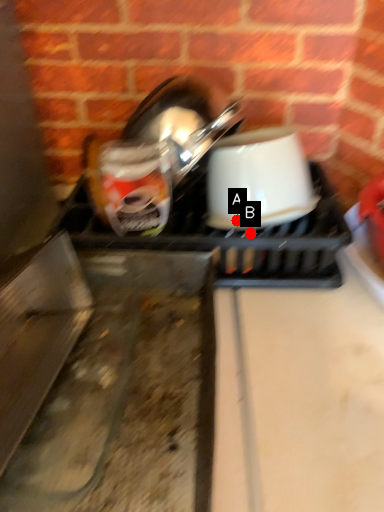
Question: Two points are circled on the image, labeled by A and B beside each circle. Which point is further to the camera?

Choices:
 (A) A is further
 (B) B is further

Answer: (A)